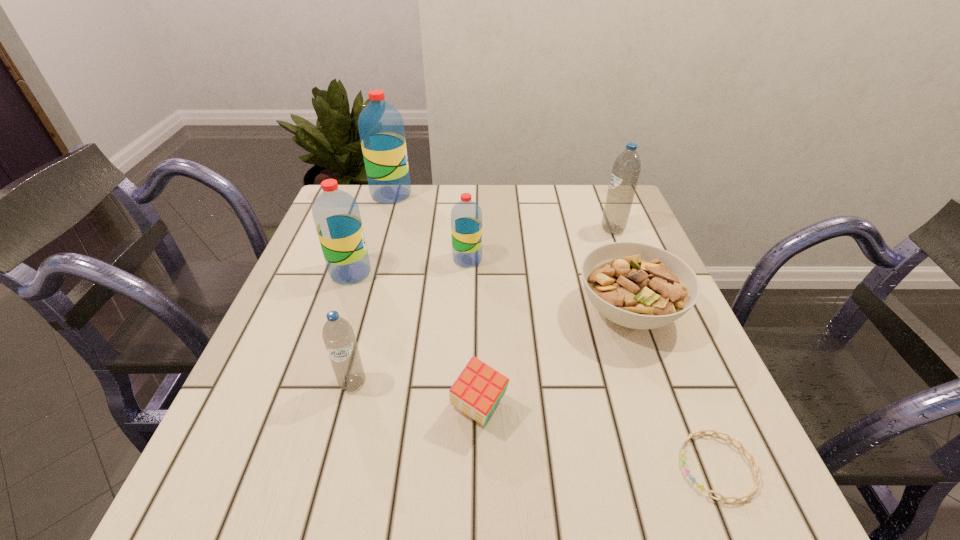
Identify which red water bottle is the third closest to the cube. Please provide its 2D coordinates. Your answer should be formatted as a tuple, i.e. [(x, y)], where the tuple contains the x and y coordinates of a point satisfying the conditions above.

[(381, 128)]

Locate an element on the screen. The image size is (960, 540). red water bottle that can be found as the third closest to the red cube is located at coordinates (381, 128).

Locate an element on the screen. The image size is (960, 540). free region that satisfies the following two spatial constraints: 1. on the front label of the tallest water bottle; 2. on the right side of the gray stew is located at coordinates coord(357,312).

Find the location of a particular element. free spot that satisfies the following two spatial constraints: 1. on the front label of the second smallest red water bottle; 2. on the back side of the cube is located at coordinates tap(304, 408).

Where is `vacant space that satisfies the following two spatial constraints: 1. on the front label of the cube; 2. on the right side of the farthest object`? vacant space that satisfies the following two spatial constraints: 1. on the front label of the cube; 2. on the right side of the farthest object is located at coordinates (328, 408).

Find the location of a particular element. The height and width of the screenshot is (540, 960). vacant space that satisfies the following two spatial constraints: 1. on the front label of the smallest red water bottle; 2. on the back side of the stew is located at coordinates (466, 312).

At what (x,y) coordinates should I click in order to perform the action: click on blank area in the image that satisfies the following two spatial constraints: 1. on the front label of the biggest red water bottle; 2. on the left side of the gray stew. Please return your answer as a coordinate pair (x, y). Image resolution: width=960 pixels, height=540 pixels. Looking at the image, I should click on (357, 312).

Where is `vacant space that satisfies the following two spatial constraints: 1. on the front label of the tallest water bottle; 2. on the right side of the stew`? This screenshot has height=540, width=960. vacant space that satisfies the following two spatial constraints: 1. on the front label of the tallest water bottle; 2. on the right side of the stew is located at coordinates (357, 312).

You are a GUI agent. You are given a task and a screenshot of the screen. Output one action in this format:
    pyautogui.click(x=<x>, y=<y>)
    Task: Click on the vacant space that satisfies the following two spatial constraints: 1. on the back side of the cube; 2. on the front label of the second biggest red water bottle
    The width and height of the screenshot is (960, 540).
    Given the screenshot: What is the action you would take?
    pyautogui.click(x=479, y=273)

Find the location of a particular element. vacant region that satisfies the following two spatial constraints: 1. on the front label of the tallest object; 2. on the left side of the nearer blue water bottle is located at coordinates (336, 383).